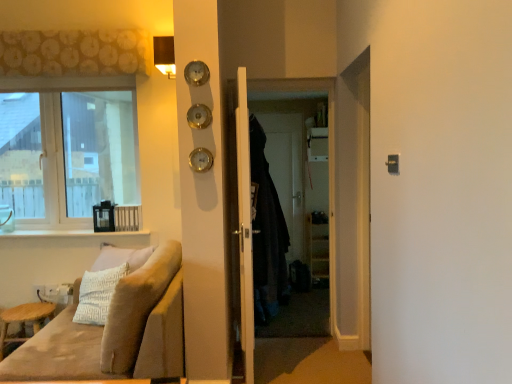
Question: Considering the relative sizes of gold metallic clock at center and patterned fabric curtain at upper left in the image provided, is gold metallic clock at center shorter than patterned fabric curtain at upper left?

Choices:
 (A) no
 (B) yes

Answer: (B)

Question: From a real-world perspective, is gold metallic clock at center positioned over patterned fabric curtain at upper left based on gravity?

Choices:
 (A) yes
 (B) no

Answer: (B)

Question: From a real-world perspective, is gold metallic clock at center under patterned fabric curtain at upper left?

Choices:
 (A) no
 (B) yes

Answer: (B)

Question: Is gold metallic clock at center thinner than patterned fabric curtain at upper left?

Choices:
 (A) yes
 (B) no

Answer: (A)

Question: Does gold metallic clock at center appear on the left side of patterned fabric curtain at upper left?

Choices:
 (A) yes
 (B) no

Answer: (B)

Question: In terms of width, does white wooden door at center look wider or thinner when compared to gold metallic clock at center?

Choices:
 (A) wide
 (B) thin

Answer: (A)

Question: From a real-world perspective, relative to gold metallic clock at center, is white wooden door at center vertically above or below?

Choices:
 (A) below
 (B) above

Answer: (A)

Question: From the image's perspective, is white wooden door at center positioned above or below gold metallic clock at center?

Choices:
 (A) above
 (B) below

Answer: (B)

Question: Does point (245, 153) appear closer or farther from the camera than point (202, 157)?

Choices:
 (A) closer
 (B) farther

Answer: (B)

Question: Is light brown wooden stool at lower left inside the boundaries of gold metallic clock at center, or outside?

Choices:
 (A) inside
 (B) outside

Answer: (B)

Question: In the image, is light brown wooden stool at lower left on the left side or the right side of gold metallic clock at center?

Choices:
 (A) left
 (B) right

Answer: (A)

Question: From the image's perspective, relative to gold metallic clock at center, is light brown wooden stool at lower left above or below?

Choices:
 (A) above
 (B) below

Answer: (B)

Question: In terms of height, does light brown wooden stool at lower left look taller or shorter compared to gold metallic clock at center?

Choices:
 (A) tall
 (B) short

Answer: (A)

Question: Is velvet beige couch at lower left in front of or behind clear glass window at upper left in the image?

Choices:
 (A) front
 (B) behind

Answer: (A)

Question: Visually, is velvet beige couch at lower left positioned to the left or to the right of clear glass window at upper left?

Choices:
 (A) right
 (B) left

Answer: (A)